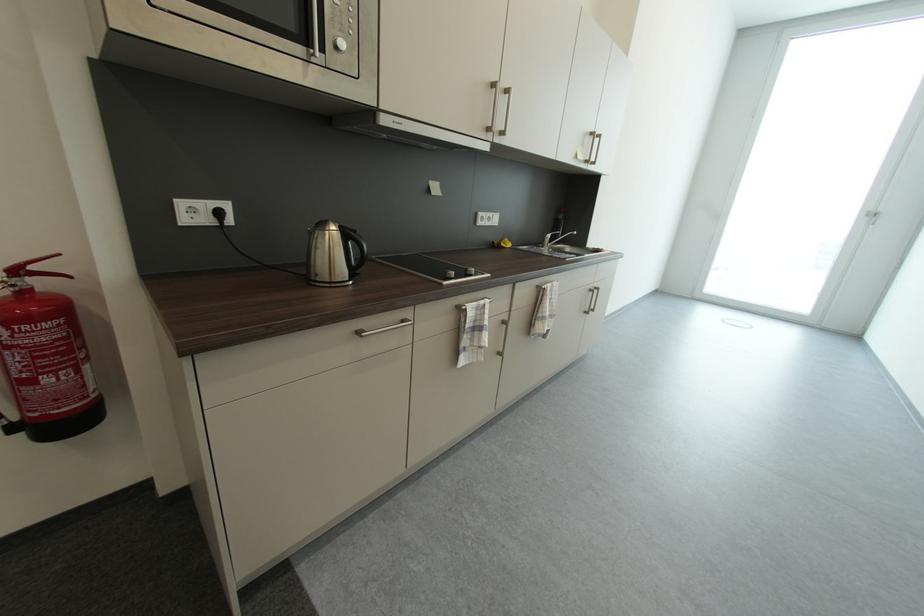
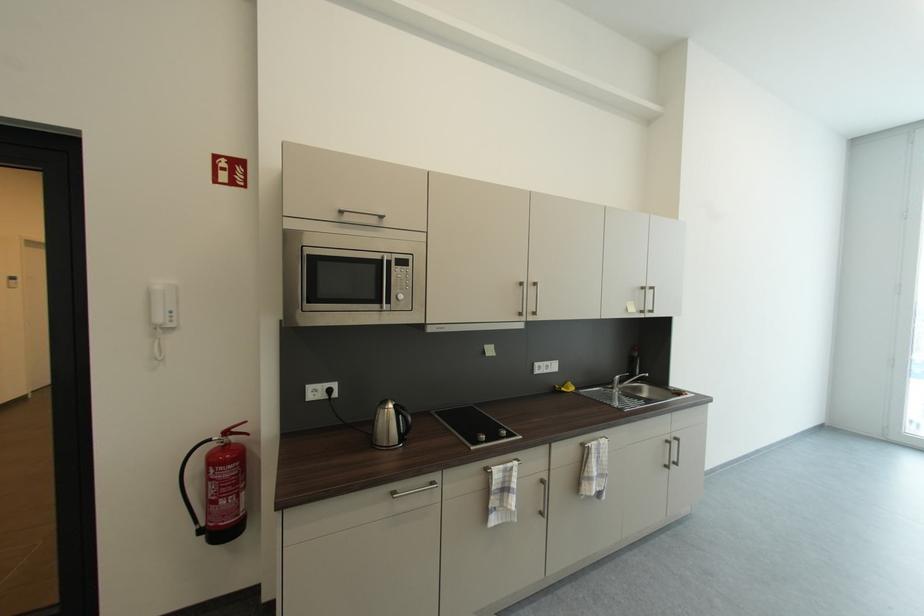
The point at (x=508, y=246) is marked in the first image. Where is the corresponding point in the second image?

(569, 391)